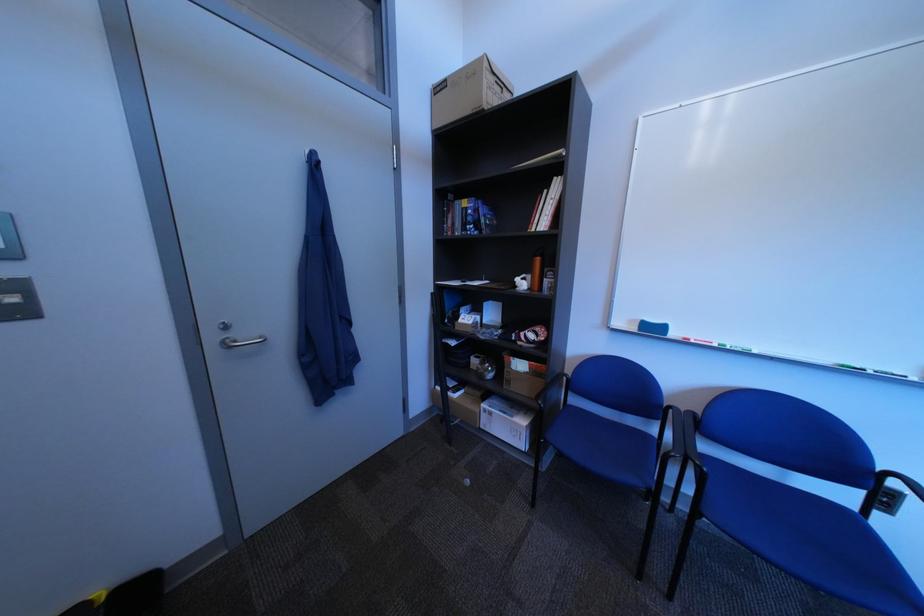
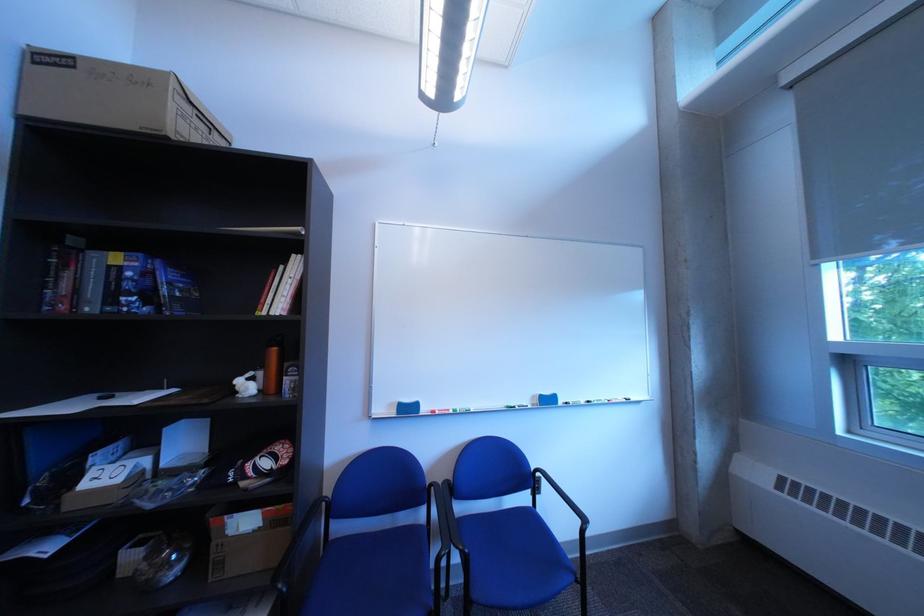
Where in the second image is the point corresponding to pixel 561 193 from the first image?

(297, 270)